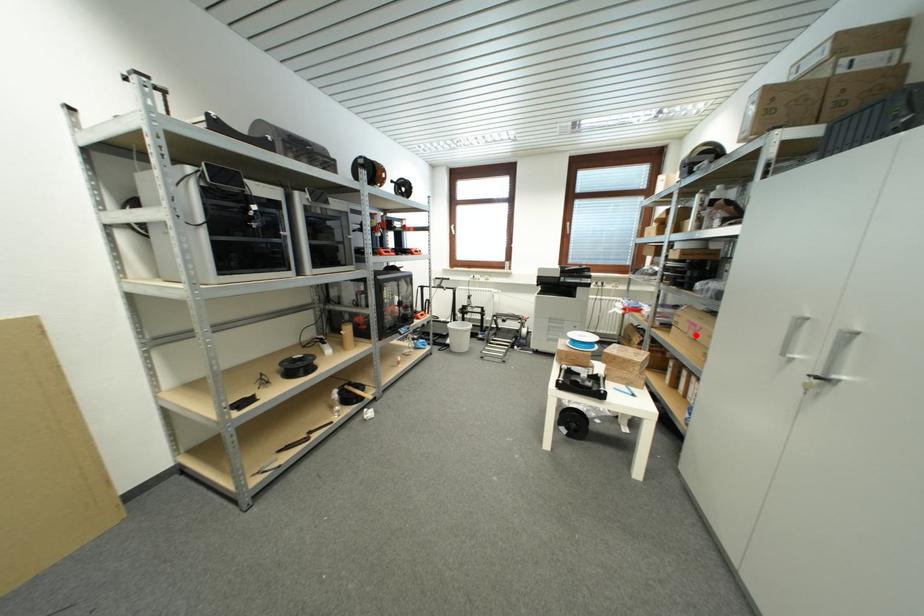
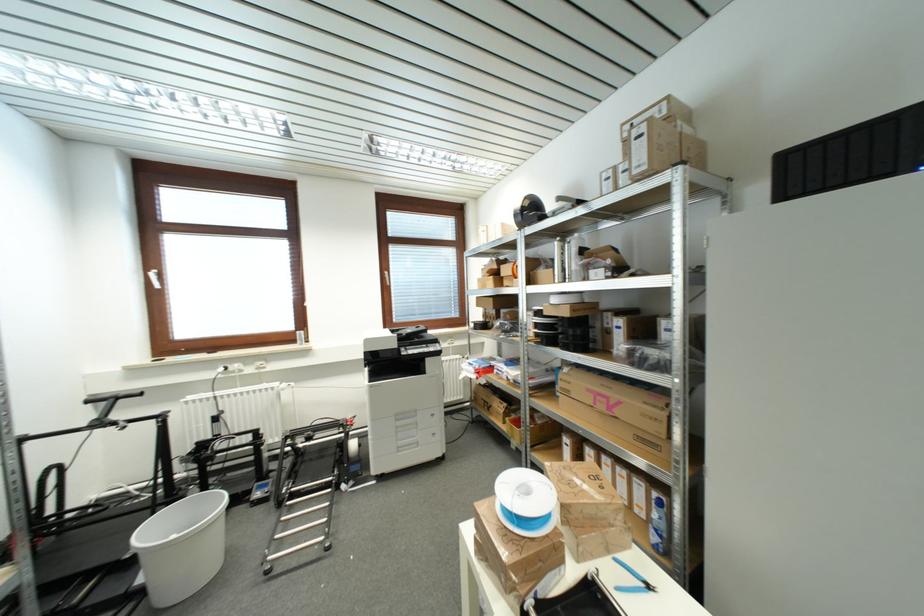
Question: A red point is marked in image1. In image2, is the corresponding 3D point closer to the camera or farther? Reply with the corresponding letter.

Choices:
 (A) The corresponding 3D point is closer.
 (B) The corresponding 3D point is farther.

Answer: (B)